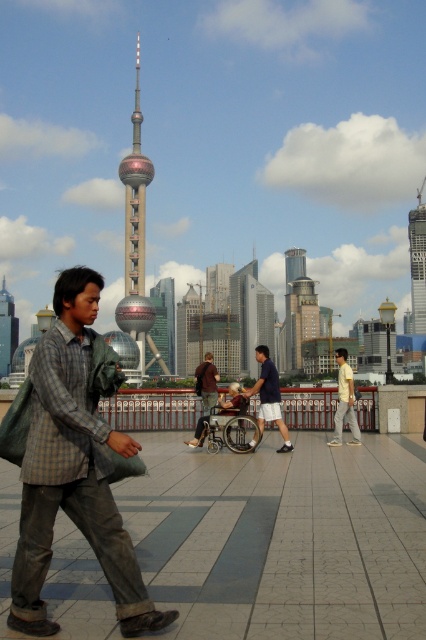
Question: Observing the image, what is the correct spatial positioning of shiny glass sphere at center in reference to brown fabric jacket at center?

Choices:
 (A) right
 (B) left

Answer: (B)

Question: Which of the following is the closest to the observer?

Choices:
 (A) shiny glass skyscraper at center
 (B) plaid fabric shirt at center
 (C) yellow cotton shirt at center

Answer: (B)

Question: Considering the real-world distances, which object is closest to the shiny metallic tower at center?

Choices:
 (A) yellow cotton shirt at center
 (B) dark blue cotton shirt at center
 (C) plaid fabric shirt at center

Answer: (B)

Question: Can you confirm if glassy steel skyscraper at center is thinner than shiny glass skyscraper at center?

Choices:
 (A) no
 (B) yes

Answer: (B)

Question: Can you confirm if plaid fabric shirt at center is positioned to the left of yellow cotton shirt at center?

Choices:
 (A) yes
 (B) no

Answer: (A)

Question: Which is nearer to the shiny glass sphere at center?

Choices:
 (A) dark blue cotton shirt at center
 (B) glassy steel skyscraper at center

Answer: (A)